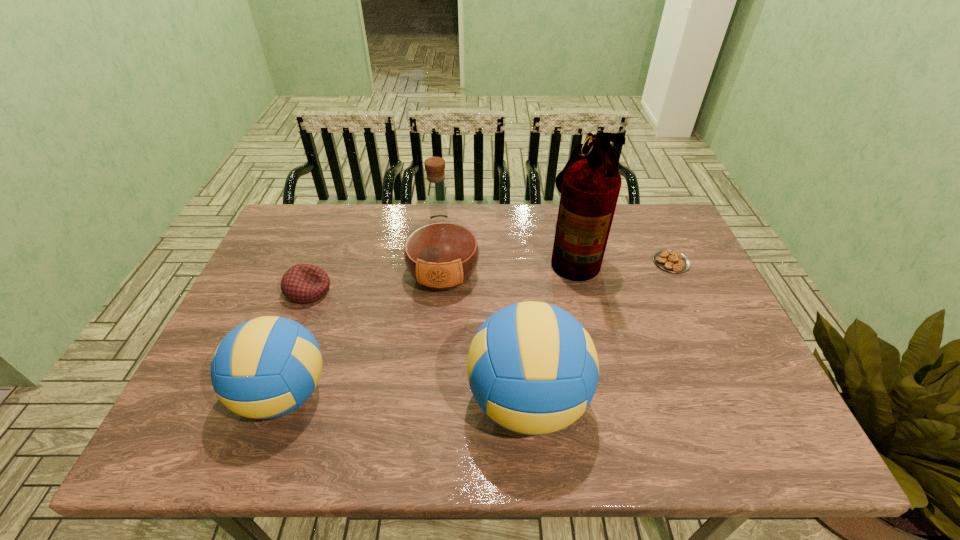
What are the coordinates of `the left volleyball` in the screenshot? It's located at (266, 367).

I want to click on the third shortest object, so click(266, 367).

At what (x,y) coordinates should I click in order to perform the action: click on the right volleyball. Please return your answer as a coordinate pair (x, y). The height and width of the screenshot is (540, 960). Looking at the image, I should click on (533, 369).

This screenshot has width=960, height=540. I want to click on the taller volleyball, so click(x=533, y=369).

The height and width of the screenshot is (540, 960). I want to click on the fifth shortest object, so click(x=441, y=253).

Identify the location of the tallest object. The image size is (960, 540). (590, 183).

The image size is (960, 540). In order to click on beanbag in this screenshot , I will do `click(303, 283)`.

The height and width of the screenshot is (540, 960). Find the location of `pastry`. pastry is located at coordinates point(669,260).

The height and width of the screenshot is (540, 960). I want to click on the rightmost object, so click(669, 260).

Find the location of `vacant region located on the right of the shorter volleyball`. vacant region located on the right of the shorter volleyball is located at coordinates click(437, 394).